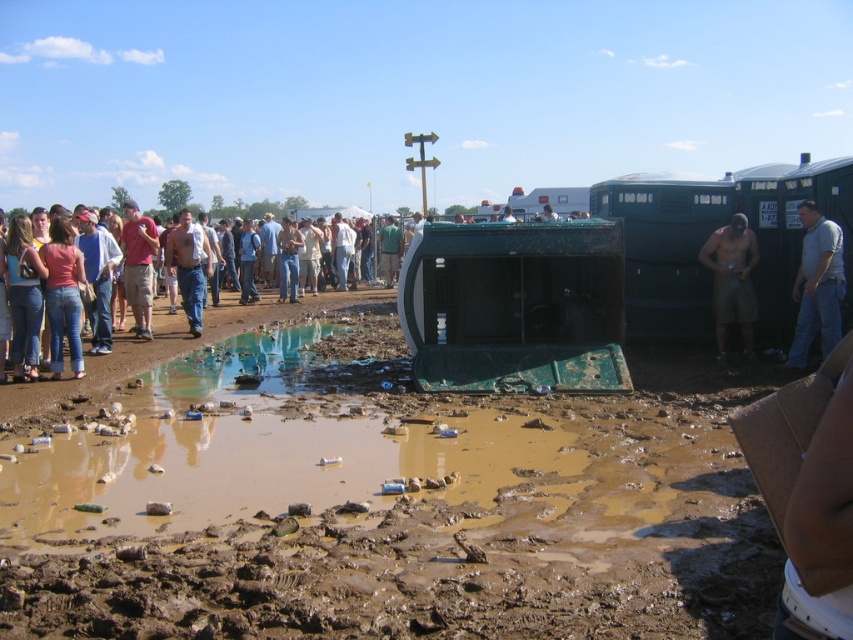
You are standing at the point marked by the coordinates point (209, 332), which is labeled as denim jeans at center. Can you see the green dumpster in the foreground?

Yes, the point (209, 332) labeled as denim jeans at center is located at the center of the image, while the green dumpster is in the foreground, so the denim jeans at center can see the green dumpster in the foreground.

You are a photographer trying to capture the crowd at the event. You notice the muddy brown dirt at center and the tan shorts at right in your frame. Based on their positions, which object is closer to the camera?

The tan shorts at right is closer to the camera because it is taller than the muddy brown dirt at center in the frame.

You are a photographer at the event and want to capture both the gray cotton shirt at right and the tan cotton shirt at center in a single frame. Which shirt should you focus on to ensure both are in the shot without zooming in or out?

You should focus on the gray cotton shirt at right because it is smaller than the tan cotton shirt at center, allowing both to fit within the frame without needing to adjust the zoom.